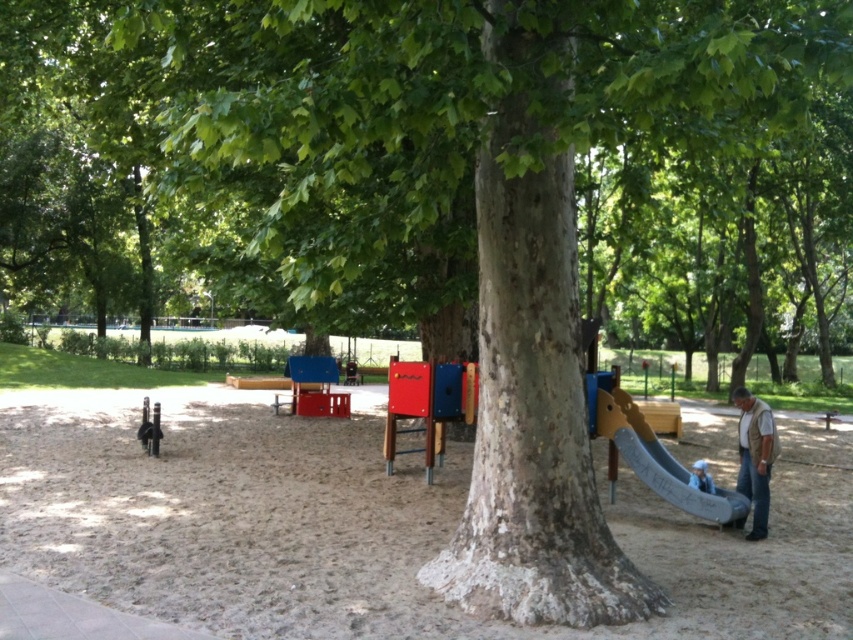
You are a parent looking for a safe place to let your child play. You see the brown sandy playground at center and the brown leather vest at lower right. Which location is lower and more suitable for the child to play on?

The brown sandy playground at center is below the brown leather vest at lower right, making it the lower and safer location for the child to play on.

Based on the photo, you are a parent trying to decide where to place a small picnic blanket. You see the brown sandy playground at center and the brown leather vest at lower right. Which location is shorter in height?

The brown sandy playground at center is shorter in height than the brown leather vest at lower right, so you should place the picnic blanket there if you want it to be lower.